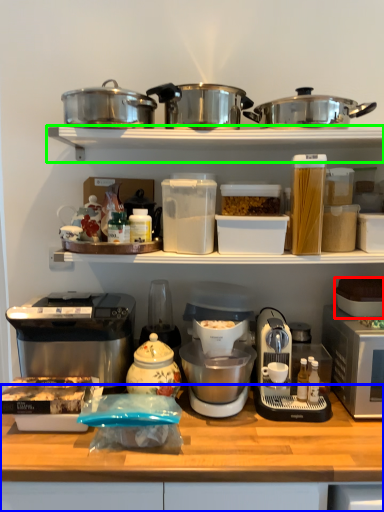
Question: Based on their relative distances, which object is farther from appliance (highlighted by a red box)? Choose from table (highlighted by a blue box) and shelf (highlighted by a green box).

Choices:
 (A) table
 (B) shelf

Answer: (B)